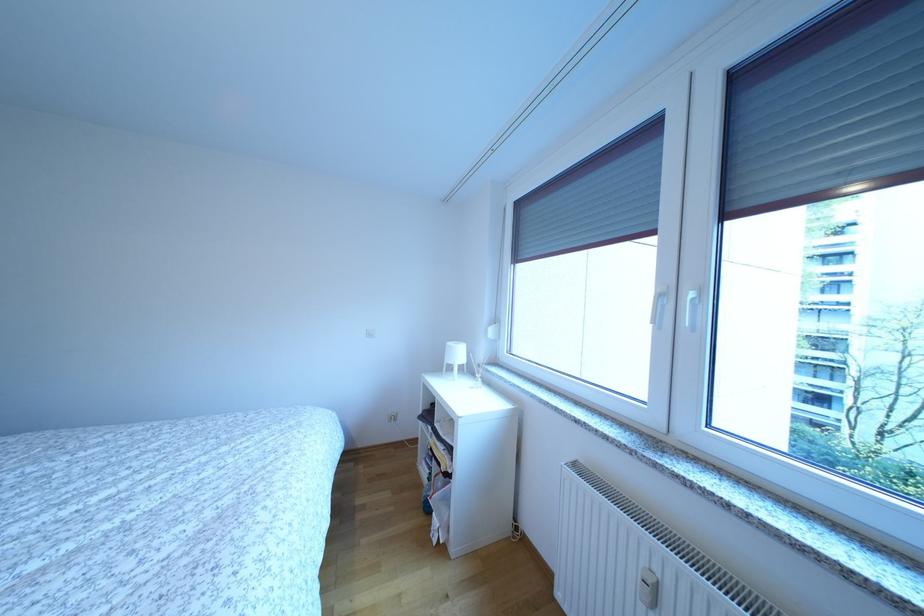
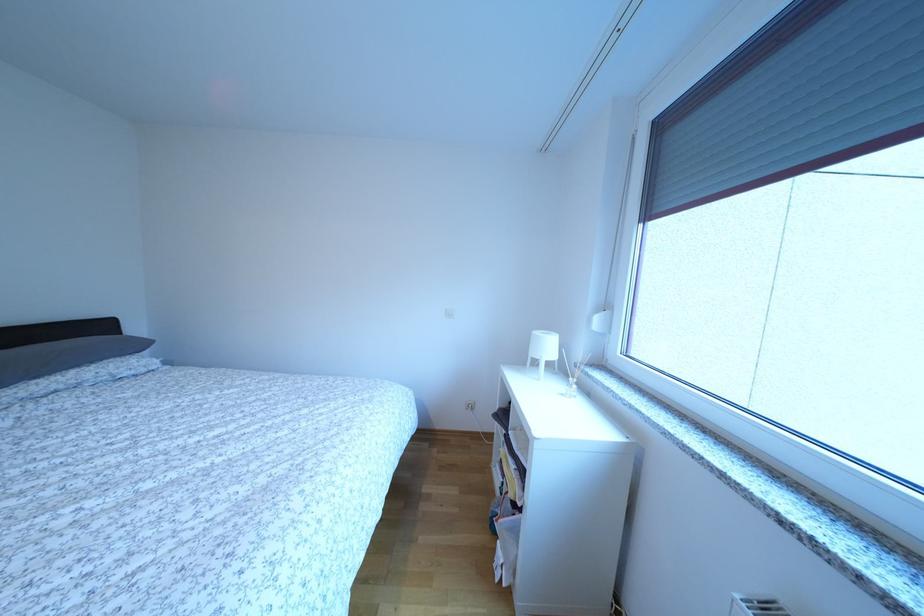
In the second image, find the point that corresponds to [466,360] in the first image.

(554, 353)